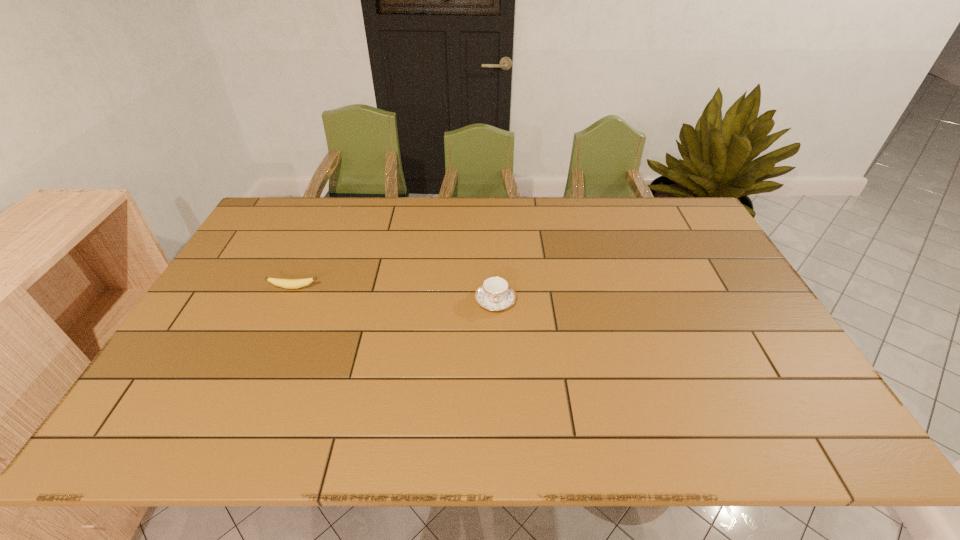
At what (x,y) coordinates should I click in order to perform the action: click on the right object. Please return your answer as a coordinate pair (x, y). Looking at the image, I should click on (495, 294).

The width and height of the screenshot is (960, 540). In order to click on teacup in this screenshot , I will do `click(495, 294)`.

Find the location of a particular element. The image size is (960, 540). the left object is located at coordinates (284, 283).

This screenshot has height=540, width=960. In order to click on banana in this screenshot , I will do `click(284, 283)`.

Locate an element on the screen. This screenshot has height=540, width=960. free space located 0.260m on the side with the handle of the taller object is located at coordinates (498, 399).

Image resolution: width=960 pixels, height=540 pixels. What are the coordinates of `free space located 0.090m on the front of the left object` in the screenshot? It's located at (282, 313).

Find the location of a particular element. This screenshot has width=960, height=540. object positioned at the left edge is located at coordinates point(284,283).

Find the location of a particular element. This screenshot has height=540, width=960. free space at the far edge of the desktop is located at coordinates (436, 222).

Find the location of a particular element. Image resolution: width=960 pixels, height=540 pixels. free space at the near edge of the desktop is located at coordinates (512, 444).

This screenshot has height=540, width=960. In the image, there is a desktop. In order to click on free space at the right edge in this screenshot , I will do `click(690, 252)`.